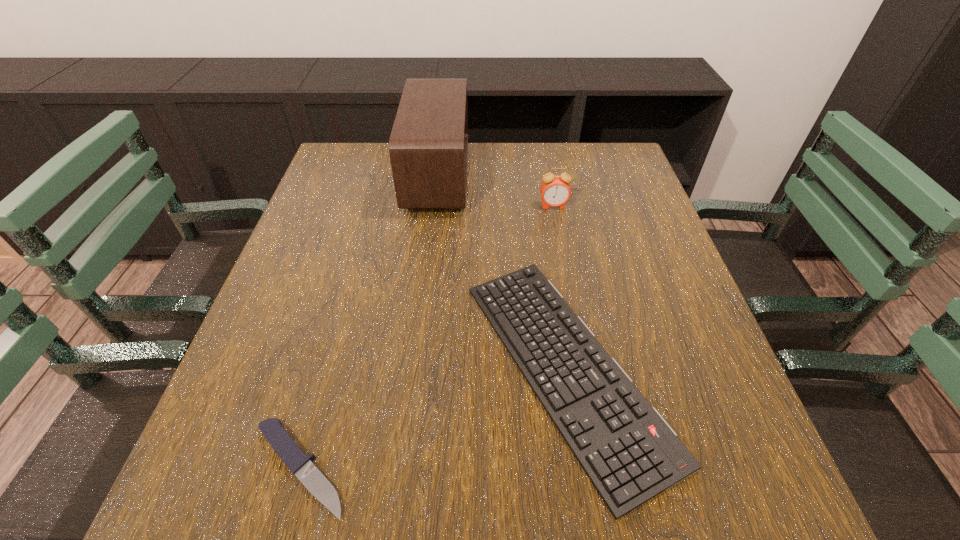
The image size is (960, 540). In the image, there is a desktop. In order to click on free space at the far right corner in this screenshot , I will do `click(625, 155)`.

You are a GUI agent. You are given a task and a screenshot of the screen. Output one action in this format:
    pyautogui.click(x=<x>, y=<y>)
    Task: Click on the unoccupied area between the radio receiver and the second shortest object
    The height and width of the screenshot is (540, 960).
    Given the screenshot: What is the action you would take?
    pyautogui.click(x=501, y=272)

At what (x,y) coordinates should I click in order to perform the action: click on vacant space in between the tallest object and the second shortest object. Please return your answer as a coordinate pair (x, y). This screenshot has width=960, height=540. Looking at the image, I should click on (501, 272).

Locate an element on the screen. free space between the third tallest object and the tallest object is located at coordinates (501, 272).

Locate an element on the screen. The image size is (960, 540). blank region between the third shortest object and the radio receiver is located at coordinates (495, 191).

This screenshot has width=960, height=540. What are the coordinates of `blank region between the radio receiver and the alarm clock` in the screenshot? It's located at (495, 191).

Where is `vacant area between the radio receiver and the second shortest object`? The width and height of the screenshot is (960, 540). vacant area between the radio receiver and the second shortest object is located at coordinates (501, 272).

Where is `free space between the second tallest object and the radio receiver`? Image resolution: width=960 pixels, height=540 pixels. free space between the second tallest object and the radio receiver is located at coordinates (495, 191).

The height and width of the screenshot is (540, 960). Find the location of `free spot between the computer keyboard and the radio receiver`. free spot between the computer keyboard and the radio receiver is located at coordinates (501, 272).

This screenshot has height=540, width=960. Find the location of `free space that is in between the computer keyboard and the shortest object`. free space that is in between the computer keyboard and the shortest object is located at coordinates (433, 418).